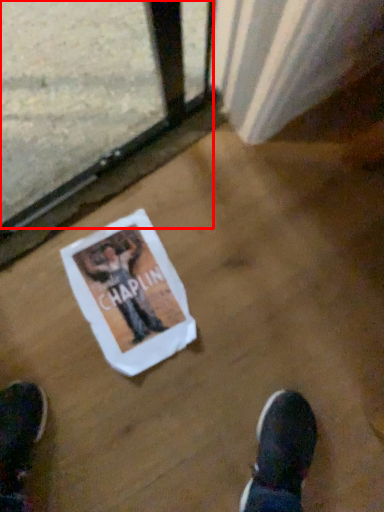
Question: Observing the image, what is the correct spatial positioning of train window (annotated by the red box) in reference to flyer?

Choices:
 (A) right
 (B) left

Answer: (B)